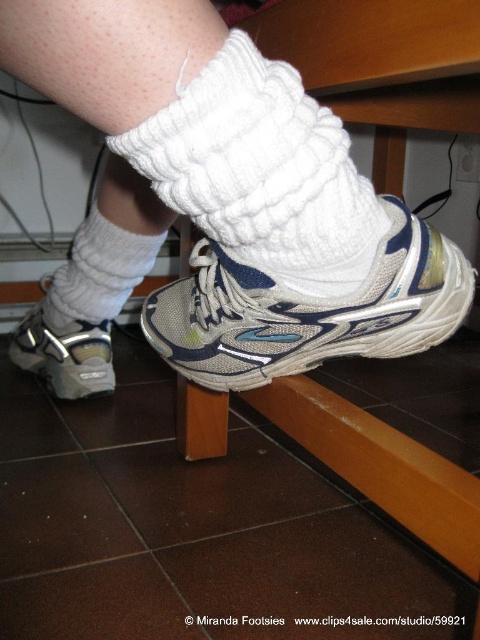
Question: Which is farther from the white knitted sock at lower center?

Choices:
 (A) white knitted sock at center
 (B) white knitted socks at center
 (C) gray mesh running shoe at lower left
 (D) white mesh shoe at lower center

Answer: (A)

Question: Can you confirm if white knitted sock at center is thinner than gray mesh running shoe at lower left?

Choices:
 (A) yes
 (B) no

Answer: (A)

Question: Does white knitted socks at center have a smaller size compared to gray mesh running shoe at lower left?

Choices:
 (A) no
 (B) yes

Answer: (A)

Question: Which object is farther from the camera taking this photo?

Choices:
 (A) white knitted sock at lower center
 (B) white knitted sock at center

Answer: (A)

Question: Is white knitted sock at center in front of white knitted sock at lower center?

Choices:
 (A) no
 (B) yes

Answer: (B)

Question: Considering the real-world distances, which object is closest to the gray mesh running shoe at lower left?

Choices:
 (A) white knitted socks at center
 (B) white mesh shoe at lower center
 (C) white knitted sock at center

Answer: (A)